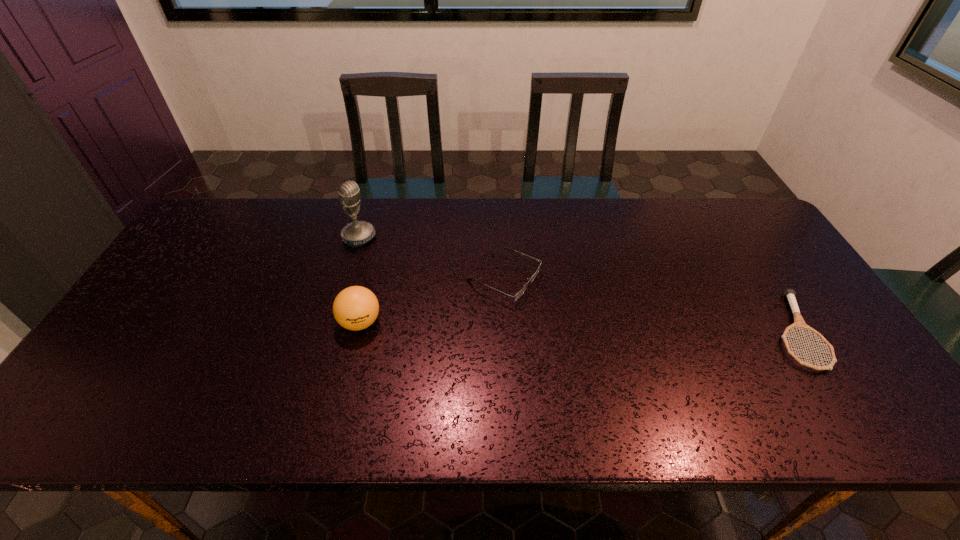
Where is `vacant area that lies between the rightmost object and the ping-pong ball`? vacant area that lies between the rightmost object and the ping-pong ball is located at coordinates (577, 327).

Locate an element on the screen. Image resolution: width=960 pixels, height=540 pixels. unoccupied position between the ping-pong ball and the third object from left to right is located at coordinates (432, 301).

The width and height of the screenshot is (960, 540). I want to click on free point between the third shortest object and the tennis racket, so click(577, 327).

The image size is (960, 540). Identify the location of blank region between the second tallest object and the second shortest object. (432, 301).

What are the coordinates of `the closest object to the spectacles` in the screenshot? It's located at (355, 308).

Find the location of a particular element. The height and width of the screenshot is (540, 960). the second closest object to the second shortest object is located at coordinates (357, 233).

You are a GUI agent. You are given a task and a screenshot of the screen. Output one action in this format:
    pyautogui.click(x=<x>, y=<y>)
    Task: Click on the blank space that satisfies the following two spatial constraints: 1. on the side with brand of the tennis racket; 2. on the right side of the ping-pong ball
    The height and width of the screenshot is (540, 960).
    Given the screenshot: What is the action you would take?
    pyautogui.click(x=358, y=331)

Where is `free space that satisfies the following two spatial constraints: 1. on the side with brand of the rightmost object; 2. on the left side of the ping-pong ball`? This screenshot has height=540, width=960. free space that satisfies the following two spatial constraints: 1. on the side with brand of the rightmost object; 2. on the left side of the ping-pong ball is located at coordinates (358, 331).

Where is `free spot that satisfies the following two spatial constraints: 1. on the front side of the rightmost object; 2. on the right side of the spectacles`? free spot that satisfies the following two spatial constraints: 1. on the front side of the rightmost object; 2. on the right side of the spectacles is located at coordinates (507, 331).

Find the location of `vacant area in the image that satisfies the following two spatial constraints: 1. on the front side of the rightmost object; 2. on the right side of the tallest object`. vacant area in the image that satisfies the following two spatial constraints: 1. on the front side of the rightmost object; 2. on the right side of the tallest object is located at coordinates (331, 331).